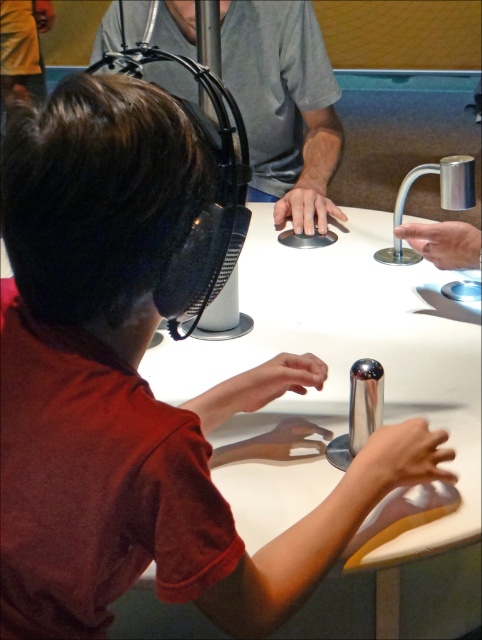
Question: Where is matte black headset at upper center located in relation to smooth silver faucet at lower center in the image?

Choices:
 (A) below
 (B) above

Answer: (B)

Question: Which object is closer to the camera taking this photo?

Choices:
 (A) polished metallic faucet at center
 (B) smooth skin hand at center

Answer: (A)

Question: Observing the image, what is the correct spatial positioning of smooth skin hand at center in reference to matte black handle at center?

Choices:
 (A) right
 (B) left

Answer: (B)

Question: Based on their relative distances, which object is farther from the matte black handle at center?

Choices:
 (A) smooth silver faucet at lower center
 (B) metallic silver faucet at right

Answer: (A)

Question: Estimate the real-world distances between objects in this image. Which object is farther from the matte black headset at upper center?

Choices:
 (A) matte black handle at center
 (B) polished metallic faucet at center

Answer: (B)

Question: Can you confirm if smooth silver faucet at lower center is positioned to the left of metallic silver faucet at right?

Choices:
 (A) yes
 (B) no

Answer: (A)